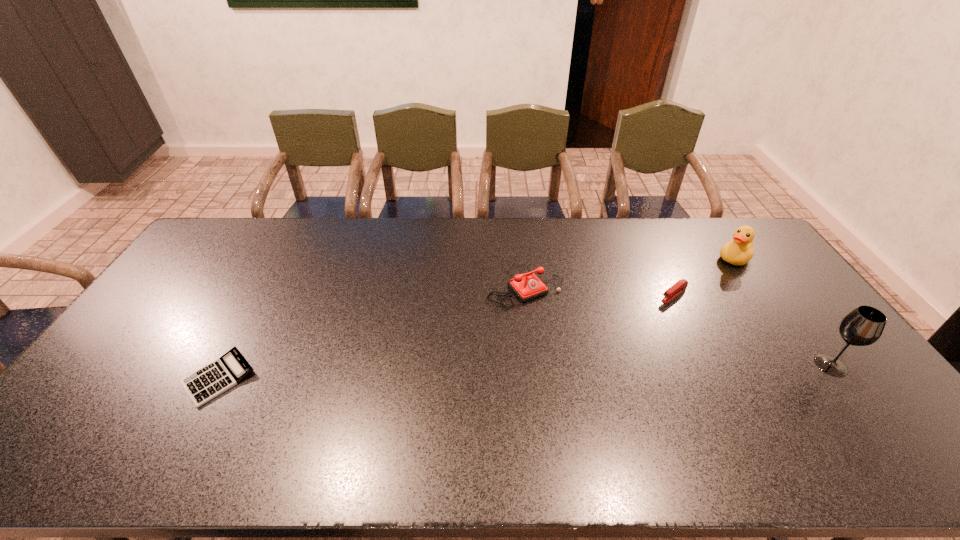
This screenshot has height=540, width=960. What are the coordinates of `calculator` in the screenshot? It's located at (203, 385).

In order to click on the leftmost object in this screenshot , I will do `click(203, 385)`.

Locate an element on the screen. the tallest object is located at coordinates (863, 326).

I want to click on telephone, so (527, 286).

You are a GUI agent. You are given a task and a screenshot of the screen. Output one action in this format:
    pyautogui.click(x=<x>, y=<y>)
    Task: Click on the third tallest object
    Image resolution: width=960 pixels, height=540 pixels.
    Given the screenshot: What is the action you would take?
    pyautogui.click(x=527, y=286)

Where is `stapler`? stapler is located at coordinates (681, 285).

Find the location of a particular element. This screenshot has width=960, height=540. the fourth tallest object is located at coordinates (681, 285).

I want to click on the second tallest object, so click(x=739, y=251).

This screenshot has width=960, height=540. Find the location of `vacant space situated on the back of the calculator`. vacant space situated on the back of the calculator is located at coordinates (247, 325).

You are a GUI agent. You are given a task and a screenshot of the screen. Output one action in this format:
    pyautogui.click(x=<x>, y=<y>)
    Task: Click on the vacant area situated on the back of the wineglass
    
    Given the screenshot: What is the action you would take?
    tap(771, 285)